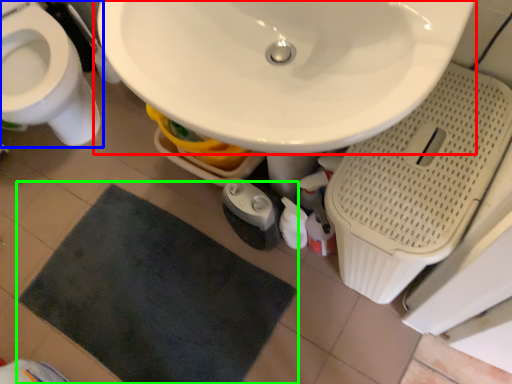
Question: Which is nearer to the sink (highlighted by a red box)? toilet (highlighted by a blue box) or bath mat (highlighted by a green box).

Choices:
 (A) toilet
 (B) bath mat

Answer: (B)